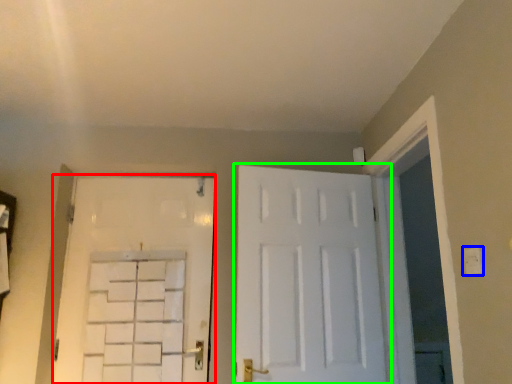
Question: Estimate the real-world distances between objects in this image. Which object is closer to door (highlighted by a red box), electric outlet (highlighted by a blue box) or door (highlighted by a green box)?

Choices:
 (A) electric outlet
 (B) door

Answer: (B)